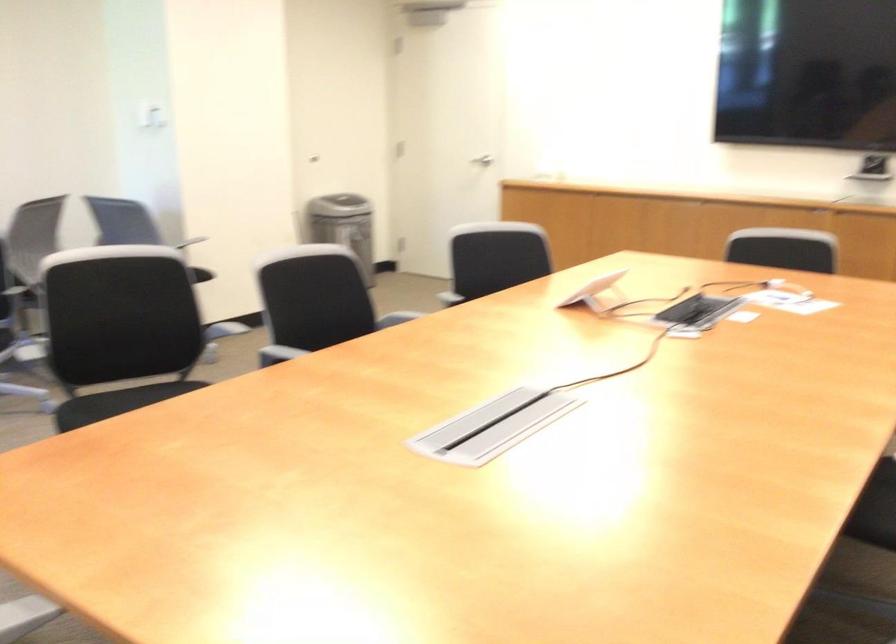
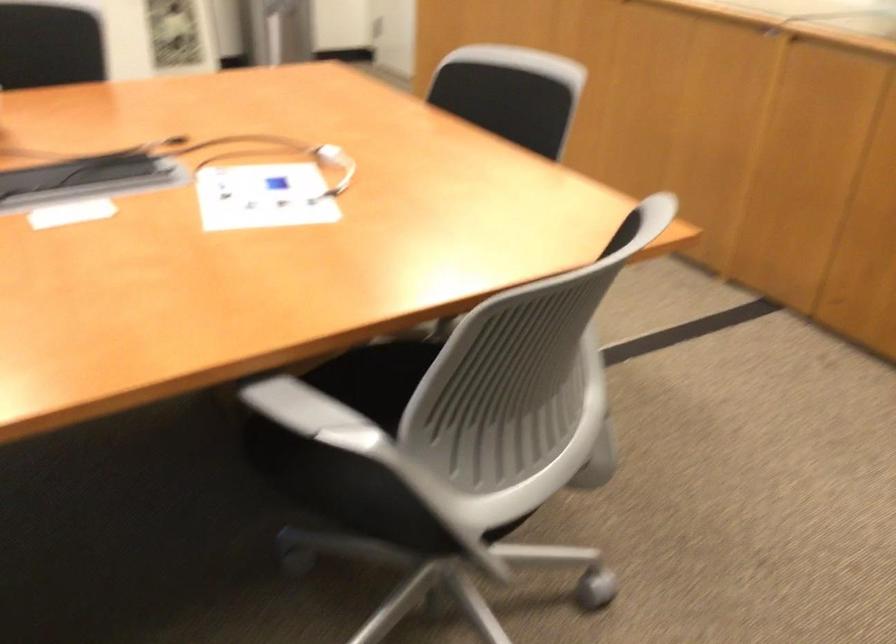
The images are taken continuously from a first-person perspective. In which direction are you moving?

The cameraman walked toward right, forward.